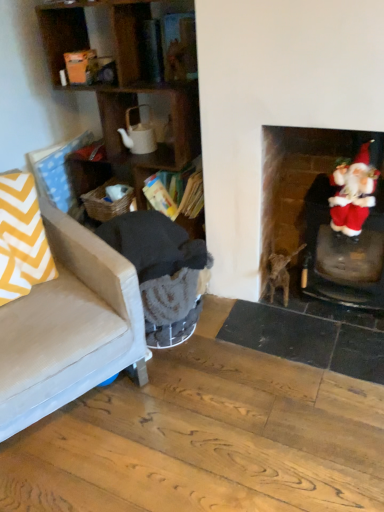
Question: Is velvet santa at right a part of beige fabric couch at left?

Choices:
 (A) no
 (B) yes

Answer: (A)

Question: Is beige fabric couch at left positioned with its back to velvet santa at right?

Choices:
 (A) yes
 (B) no

Answer: (B)

Question: Considering the relative positions of beige fabric couch at left and velvet santa at right in the image provided, is beige fabric couch at left to the left of velvet santa at right from the viewer's perspective?

Choices:
 (A) yes
 (B) no

Answer: (A)

Question: Is beige fabric couch at left to the right of velvet santa at right from the viewer's perspective?

Choices:
 (A) no
 (B) yes

Answer: (A)

Question: Would you say beige fabric couch at left is a long distance from velvet santa at right?

Choices:
 (A) no
 (B) yes

Answer: (A)

Question: Is the position of beige fabric couch at left less distant than that of velvet santa at right?

Choices:
 (A) yes
 (B) no

Answer: (A)

Question: From the image's perspective, would you say woven brown laundry basket at lower left is shown under wooden shelves at left?

Choices:
 (A) no
 (B) yes

Answer: (B)

Question: From the image's perspective, is woven brown laundry basket at lower left on top of wooden shelves at left?

Choices:
 (A) yes
 (B) no

Answer: (B)

Question: Is woven brown laundry basket at lower left positioned far away from wooden shelves at left?

Choices:
 (A) yes
 (B) no

Answer: (B)

Question: Is wooden shelves at left completely or partially inside woven brown laundry basket at lower left?

Choices:
 (A) no
 (B) yes

Answer: (A)

Question: Is woven brown laundry basket at lower left at the left side of wooden shelves at left?

Choices:
 (A) yes
 (B) no

Answer: (A)

Question: Does woven brown laundry basket at lower left come behind wooden shelves at left?

Choices:
 (A) yes
 (B) no

Answer: (A)

Question: From the image's perspective, is dark gray fabric rocking chair at left located above wooden bookshelf at center?

Choices:
 (A) no
 (B) yes

Answer: (A)